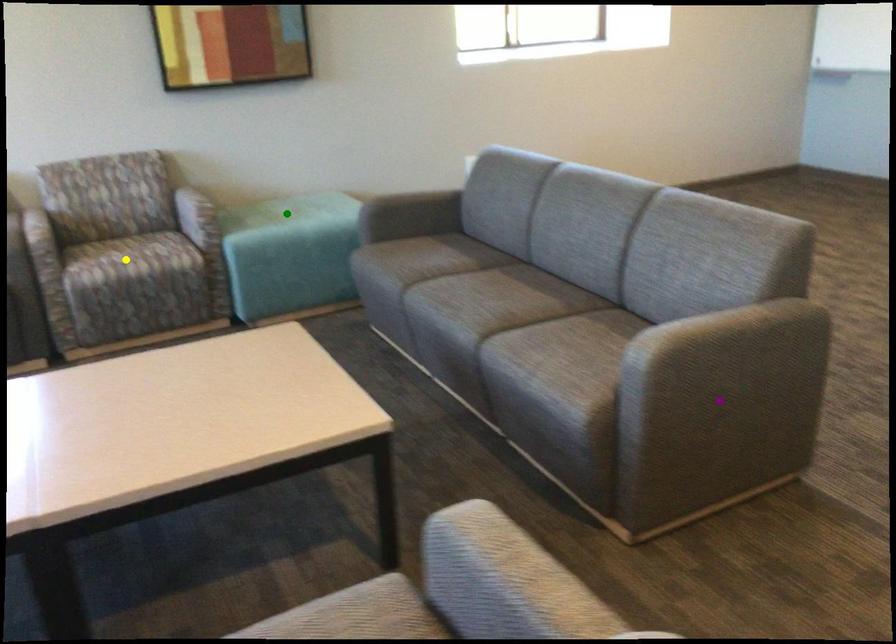
Order these from nearest to farthest:
yellow point
green point
purple point

1. green point
2. yellow point
3. purple point